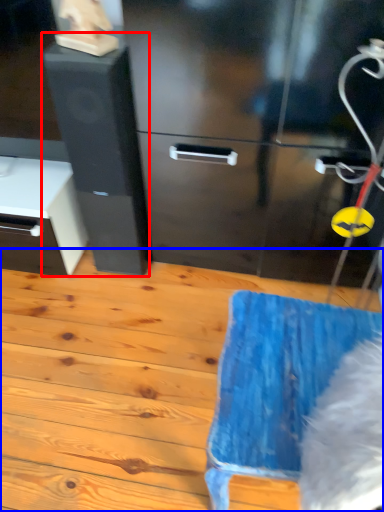
Question: Which object appears closest to the camera in this image, file cabinet (highlighted by a red box) or wood (highlighted by a blue box)?

Choices:
 (A) file cabinet
 (B) wood

Answer: (B)